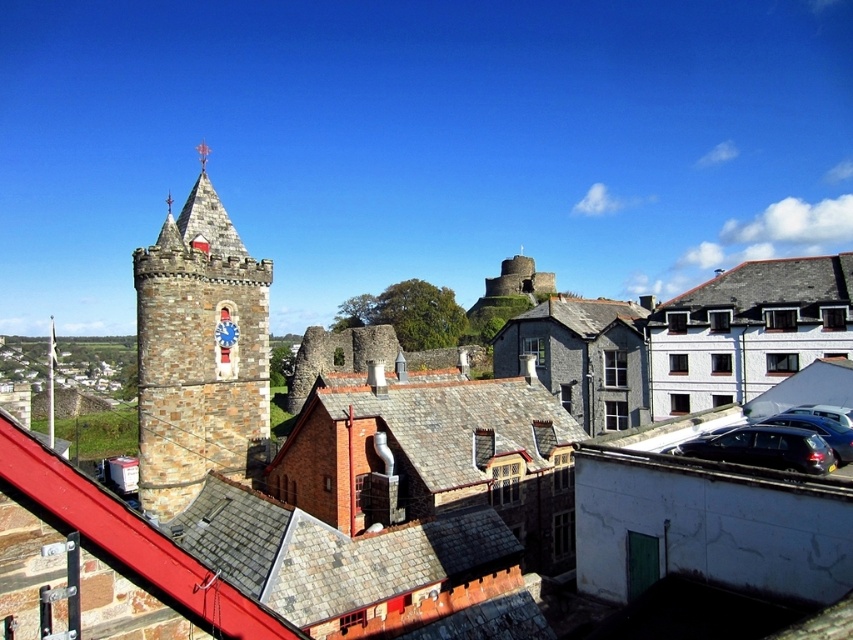
Question: Can you confirm if stone clock tower at left is bigger than shiny black sedan at lower right?

Choices:
 (A) no
 (B) yes

Answer: (B)

Question: Is stone clock tower at left positioned in front of shiny black sedan at lower right?

Choices:
 (A) no
 (B) yes

Answer: (A)

Question: Which object is closer to the camera taking this photo?

Choices:
 (A) sleek silver sedan at center-right
 (B) shiny black car at lower right

Answer: (B)

Question: Is stone clock tower at left above sleek silver sedan at center-right?

Choices:
 (A) yes
 (B) no

Answer: (A)

Question: Which point is closer to the camera?

Choices:
 (A) (194, 356)
 (B) (784, 412)
 (C) (817, 314)

Answer: (B)

Question: Which object is closer to the camera taking this photo?

Choices:
 (A) shiny black sedan at lower right
 (B) stone clock tower at left
 (C) sleek silver sedan at center-right
 (D) gray slate roof at upper right

Answer: (A)